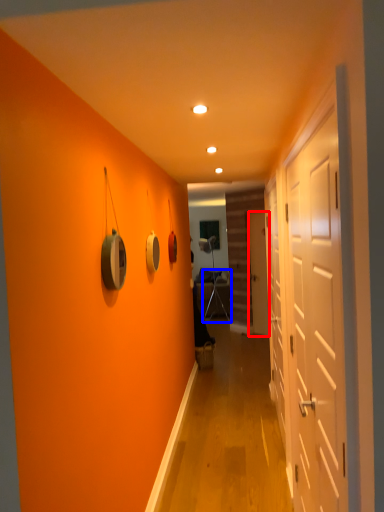
Question: Among these objects, which one is farthest to the camera, door (highlighted by a red box) or armchair (highlighted by a blue box)?

Choices:
 (A) door
 (B) armchair

Answer: (B)